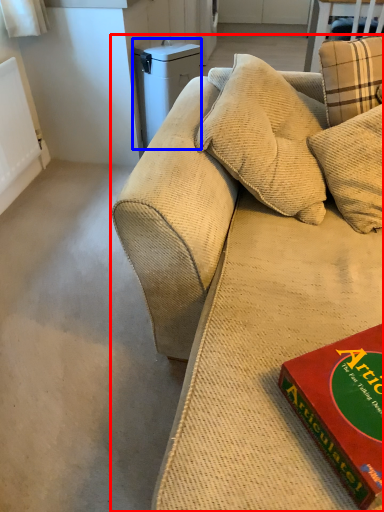
Question: Which point is further to the camera, studio couch (highlighted by a red box) or appliance (highlighted by a blue box)?

Choices:
 (A) studio couch
 (B) appliance

Answer: (B)